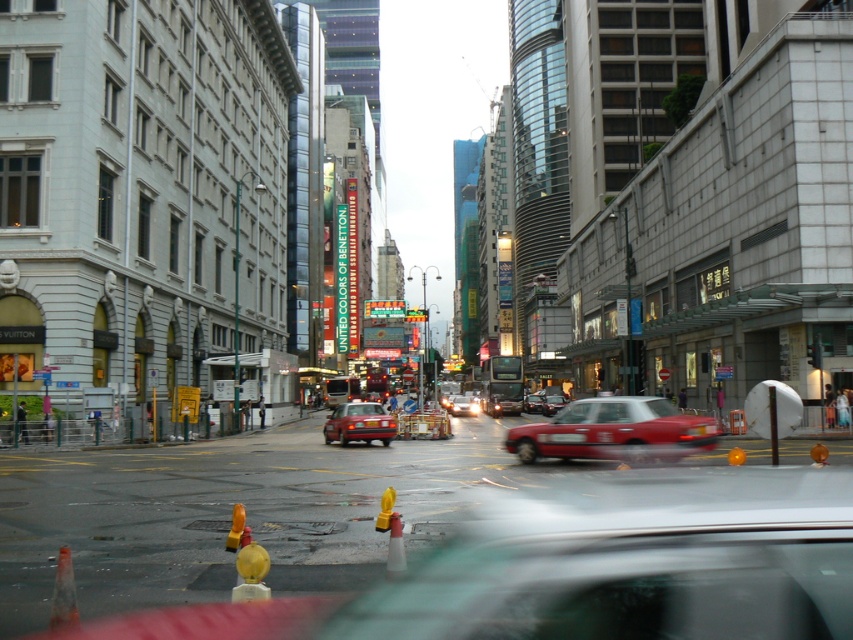
Which of these two, orange plastic traffic cone at lower left or matte red sedan at center, stands shorter?

orange plastic traffic cone at lower left

Based on the photo, does orange plastic traffic cone at lower left have a lesser height compared to matte red sedan at center?

Correct, orange plastic traffic cone at lower left is not as tall as matte red sedan at center.

Is point (68, 576) less distant than point (462, 406)?

Yes, point (68, 576) is in front of point (462, 406).

Locate an element on the screen. Image resolution: width=853 pixels, height=640 pixels. orange plastic traffic cone at lower left is located at coordinates (62, 593).

Between point (56, 577) and point (389, 531), which one is positioned behind?

The point (389, 531) is behind.

Which is above, orange plastic traffic cone at lower left or orange plastic traffic cone at center?

Positioned higher is orange plastic traffic cone at lower left.

This screenshot has height=640, width=853. Describe the element at coordinates (62, 593) in the screenshot. I see `orange plastic traffic cone at lower left` at that location.

Find the location of `orange plastic traffic cone at lower left`. orange plastic traffic cone at lower left is located at coordinates (62, 593).

Measure the distance from orange plastic traffic cone at center to orange rubber traffic cone at lower center.

orange plastic traffic cone at center is 4.35 feet from orange rubber traffic cone at lower center.

Which is above, orange plastic traffic cone at center or orange rubber traffic cone at lower center?

orange rubber traffic cone at lower center is higher up.

Find the location of a particular element. orange plastic traffic cone at center is located at coordinates (395, 547).